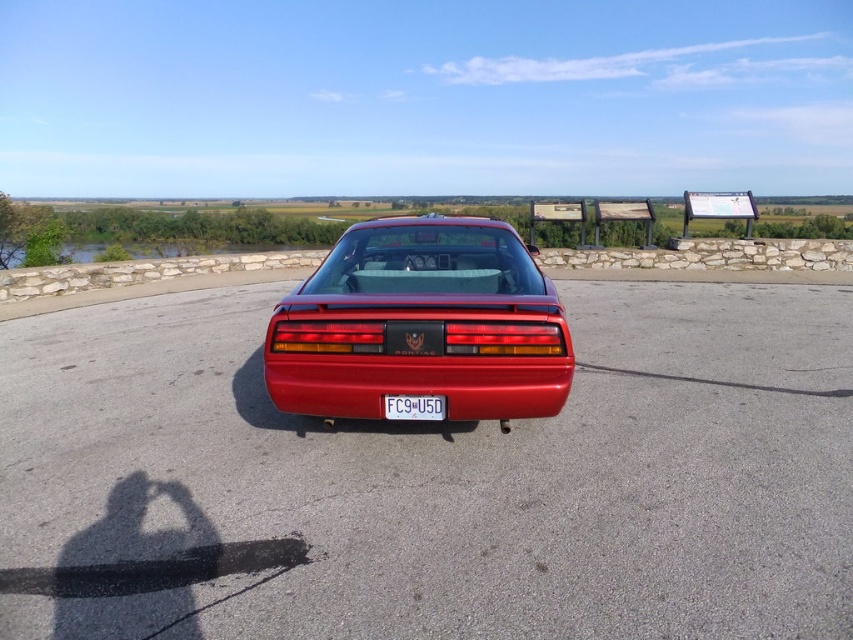
Who is positioned more to the left, glossy red car at center or glossy red bumper at center?

glossy red bumper at center

Measure the distance between glossy red car at center and camera.

They are 3.10 meters apart.

Where is `glossy red car at center`? glossy red car at center is located at coordinates (421, 324).

Which is above, glossy red bumper at center or white plastic license plate at center?

Positioned higher is glossy red bumper at center.

Is glossy red bumper at center smaller than white plastic license plate at center?

No, glossy red bumper at center is not smaller than white plastic license plate at center.

This screenshot has height=640, width=853. I want to click on glossy red bumper at center, so click(416, 384).

Where is `glossy red bumper at center`? Image resolution: width=853 pixels, height=640 pixels. glossy red bumper at center is located at coordinates (416, 384).

Can you confirm if glossy red car at center is taller than white plastic license plate at center?

Correct, glossy red car at center is much taller as white plastic license plate at center.

Which is behind, point (509, 285) or point (415, 400)?

Positioned behind is point (509, 285).

Describe the element at coordinates (421, 324) in the screenshot. I see `glossy red car at center` at that location.

In order to click on glossy red car at center in this screenshot , I will do `click(421, 324)`.